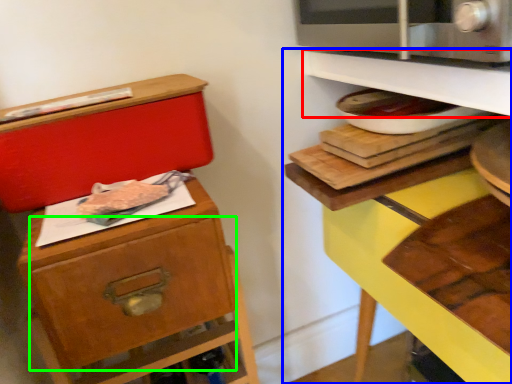
Question: Which is nearer to the shelf (highlighted by a red box)? shelf (highlighted by a blue box) or drawer (highlighted by a green box).

Choices:
 (A) shelf
 (B) drawer

Answer: (A)